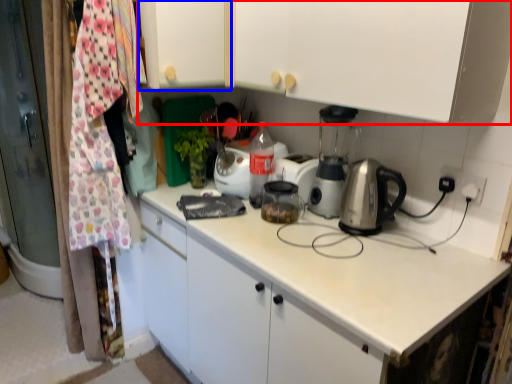
Question: Which object appears closest to the camera in this image, cabinetry (highlighted by a red box) or cabinetry (highlighted by a blue box)?

Choices:
 (A) cabinetry
 (B) cabinetry

Answer: (A)